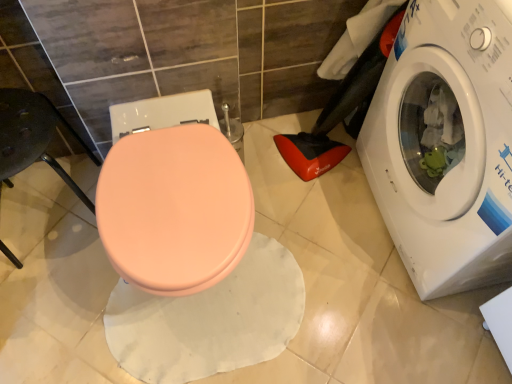
Locate an element on the screen. This screenshot has width=512, height=384. free region under matte pink seat at left (from a real-world perspective) is located at coordinates (59, 220).